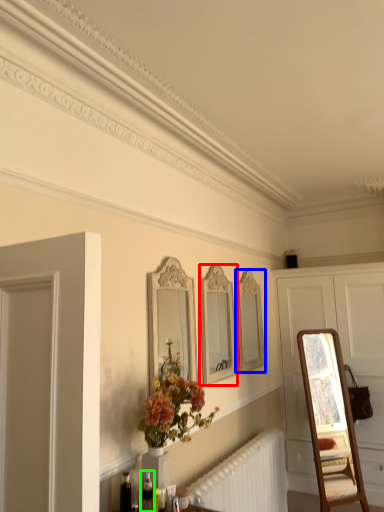
Question: Based on their relative distances, which object is farther from mirror (highlighted by a red box)? Choose from mirror (highlighted by a blue box) and toiletry (highlighted by a green box).

Choices:
 (A) mirror
 (B) toiletry

Answer: (B)